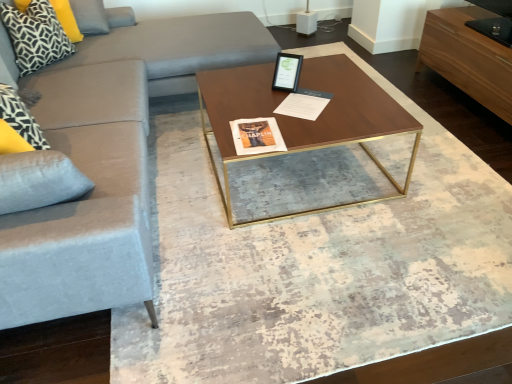
Where is `vacant space to the right of white paper at center`? This screenshot has width=512, height=384. vacant space to the right of white paper at center is located at coordinates (348, 98).